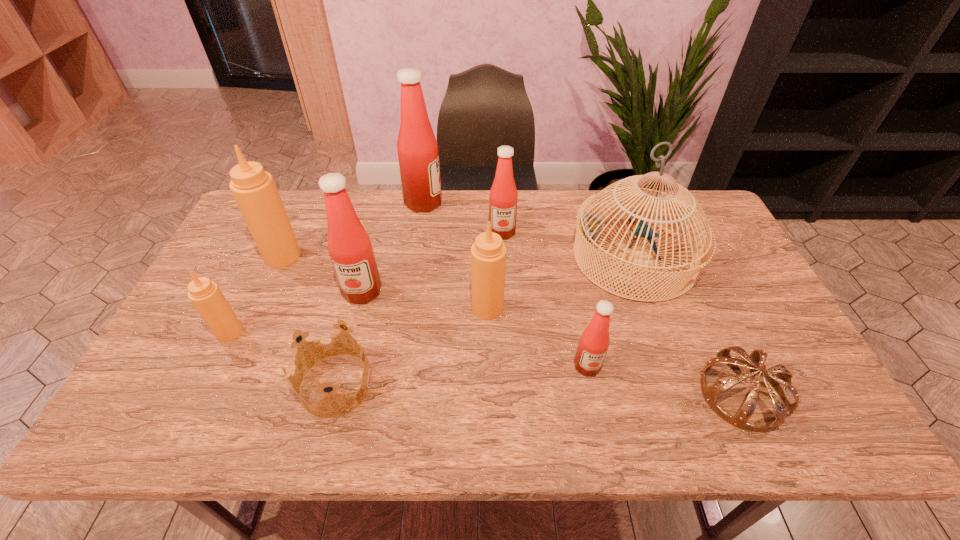
This screenshot has width=960, height=540. What are the coordinates of `free space between the biggest tan condiment and the nearest tan condiment` in the screenshot? It's located at (256, 294).

Locate an element on the screen. The width and height of the screenshot is (960, 540). empty space between the second biggest tan condiment and the brown tiara is located at coordinates (614, 351).

Where is `vacant space that's between the birdcage and the second red condiment from left to right`? This screenshot has width=960, height=540. vacant space that's between the birdcage and the second red condiment from left to right is located at coordinates (529, 230).

You are a GUI agent. You are given a task and a screenshot of the screen. Output one action in this format:
    pyautogui.click(x=<x>, y=<y>)
    Task: Click on the blank region between the tiara and the third red condiment from right to left
    This screenshot has width=960, height=540.
    Given the screenshot: What is the action you would take?
    pyautogui.click(x=583, y=299)

Image resolution: width=960 pixels, height=540 pixels. Find the location of `vacant area between the tiara and the biggest tan condiment`. vacant area between the tiara and the biggest tan condiment is located at coordinates (513, 325).

Locate an element on the screen. The width and height of the screenshot is (960, 540). empty space that is in between the rightmost tan condiment and the farthest tan condiment is located at coordinates (385, 282).

I want to click on free space between the biggest tan condiment and the sixth farthest condiment, so click(x=256, y=294).

Find the location of a particular element. The height and width of the screenshot is (540, 960). vacant point located between the fifth nearest condiment and the rightmost condiment is located at coordinates (435, 310).

Identify which object is located as the nearest to the fourth condiment from left to right. Please provide its 2D coordinates. Your answer should be formatted as a tuple, i.e. [(x, y)], where the tuple contains the x and y coordinates of a point satisfying the conditions above.

[(503, 196)]

At what (x,y) coordinates should I click in order to perform the action: click on object identified as the third closest to the second farthest tan condiment. Please return your answer as a coordinate pair (x, y). This screenshot has height=540, width=960. Looking at the image, I should click on (503, 196).